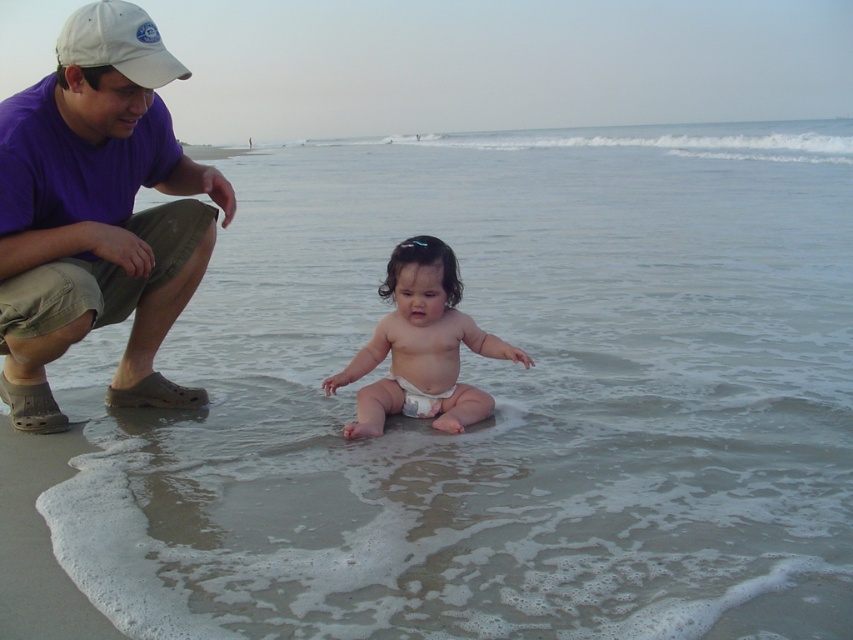
Looking at this image, you are a photographer trying to capture the scene of the purple cotton shirt at upper left and the white diaper toddler at center. Based on their positions, which object is higher in the image?

The purple cotton shirt at upper left is above the white diaper toddler at center, so it is higher in the image.

You are standing at the edge of the beach looking at the scene. There are two points marked in the image. One is at coordinate point (1,349) and the other is at point (422,408). Which point is closer to you?

Point (1,349) is closer to the viewer than point (422,408).

Based on the photo, you are a photographer trying to capture the scene of the man and the baby. You need to focus your camera on the purple cotton shirt at upper left and the white fabric cap at upper left. Which object should you adjust your focus to first if you want to ensure both are in focus without moving the camera?

The purple cotton shirt at upper left is located below the white fabric cap at upper left, so you should focus on the white fabric cap at upper left first since it is farther away. This way, the depth of field will include both objects in focus.